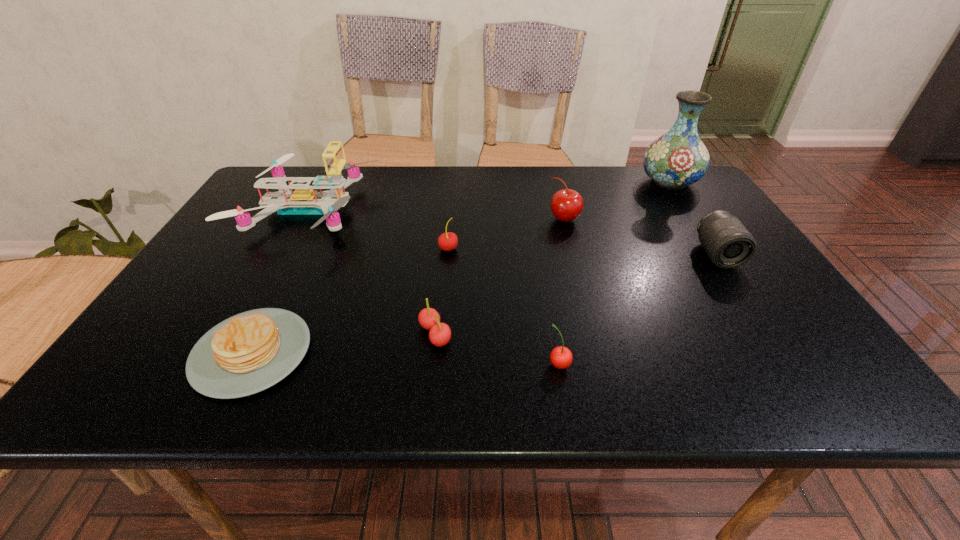
I want to click on unoccupied position between the seventh shortest object and the tallest object, so click(x=489, y=196).

You are a GUI agent. You are given a task and a screenshot of the screen. Output one action in this format:
    pyautogui.click(x=<x>, y=<y>)
    Task: Click on the unoccupied area between the third nearest cherry and the second tallest object
    The height and width of the screenshot is (540, 960).
    Given the screenshot: What is the action you would take?
    pyautogui.click(x=378, y=230)

This screenshot has height=540, width=960. Identify the location of empty location between the third object from right to left and the drone. (436, 214).

Identify the location of vacant space that's between the second tallest object and the pancake. (280, 281).

In order to click on free point between the telephoto lens and the farthest cherry in this screenshot , I will do `click(640, 237)`.

Where is `unoccupied area between the shortest object and the farthest cherry`? The width and height of the screenshot is (960, 540). unoccupied area between the shortest object and the farthest cherry is located at coordinates (408, 286).

Find the location of a particular element. Image resolution: width=960 pixels, height=540 pixels. object identified as the seventh closest to the tallest object is located at coordinates (247, 353).

The image size is (960, 540). Identify the location of object that is the third nearest to the drone. (440, 333).

The image size is (960, 540). What are the coordinates of `cherry that can be found as the second closest to the third nearest cherry` in the screenshot? It's located at (566, 205).

The height and width of the screenshot is (540, 960). I want to click on cherry that can be found as the closest to the tallest object, so click(x=566, y=205).